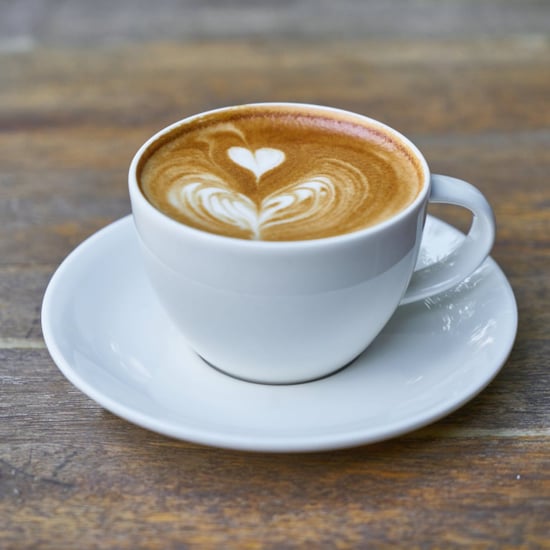
Locate an element on the screen. table is located at coordinates (190, 477).